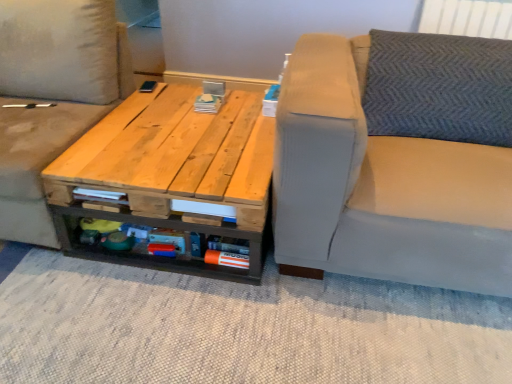
What is the approximate width of light beige fabric studio couch at right, which appears as the second studio couch when viewed from the left?

The width of light beige fabric studio couch at right, which appears as the second studio couch when viewed from the left, is 1.00 meters.

This screenshot has width=512, height=384. In order to click on light beige fabric studio couch at right, arranged as the 1th studio couch when viewed from the right in this screenshot , I will do `click(397, 159)`.

Identify the location of light beige fabric studio couch at right, which appears as the second studio couch when viewed from the left. (397, 159).

Is light beige fabric studio couch at right, arranged as the 1th studio couch when viewed from the right, in front of light beige fabric studio couch at center, which is counted as the first studio couch, starting from the left?

That is True.

Choose the correct answer: Is light beige fabric studio couch at right, arranged as the 1th studio couch when viewed from the right, inside light beige fabric studio couch at center, which appears as the 2th studio couch when viewed from the right, or outside it?

light beige fabric studio couch at right, arranged as the 1th studio couch when viewed from the right, is not inside light beige fabric studio couch at center, which appears as the 2th studio couch when viewed from the right, it's outside.

Which is more to the right, light beige fabric studio couch at right, arranged as the 1th studio couch when viewed from the right, or light beige fabric studio couch at center, which is counted as the first studio couch, starting from the left?

light beige fabric studio couch at right, arranged as the 1th studio couch when viewed from the right.

From the image's perspective, is light beige fabric studio couch at right, which appears as the second studio couch when viewed from the left, above or below light beige fabric studio couch at center, which appears as the 2th studio couch when viewed from the right?

Based on their image positions, light beige fabric studio couch at right, which appears as the second studio couch when viewed from the left, is located beneath light beige fabric studio couch at center, which appears as the 2th studio couch when viewed from the right.

Is natural wood table at center in front of light beige fabric studio couch at right, which appears as the second studio couch when viewed from the left?

That is False.

From a real-world perspective, is natural wood table at center positioned above or below light beige fabric studio couch at right, which appears as the second studio couch when viewed from the left?

natural wood table at center is below light beige fabric studio couch at right, which appears as the second studio couch when viewed from the left.

Is natural wood table at center bigger than light beige fabric studio couch at right, which appears as the second studio couch when viewed from the left?

Incorrect, natural wood table at center is not larger than light beige fabric studio couch at right, which appears as the second studio couch when viewed from the left.

Is light beige fabric studio couch at center, which appears as the 2th studio couch when viewed from the right, to the right of natural wood table at center from the viewer's perspective?

No, light beige fabric studio couch at center, which appears as the 2th studio couch when viewed from the right, is not to the right of natural wood table at center.

Does light beige fabric studio couch at center, which appears as the 2th studio couch when viewed from the right, lie behind natural wood table at center?

No, light beige fabric studio couch at center, which appears as the 2th studio couch when viewed from the right, is closer to the viewer.

Is point (84, 68) positioned before point (196, 134)?

That is False.

Looking at the image, does light beige fabric studio couch at center, which appears as the 2th studio couch when viewed from the right, seem bigger or smaller compared to natural wood table at center?

light beige fabric studio couch at center, which appears as the 2th studio couch when viewed from the right, is bigger than natural wood table at center.

How much distance is there between natural wood table at center and light beige fabric studio couch at center, which appears as the 2th studio couch when viewed from the right?

natural wood table at center and light beige fabric studio couch at center, which appears as the 2th studio couch when viewed from the right, are 13.68 inches apart.

In terms of size, does natural wood table at center appear bigger or smaller than light beige fabric studio couch at center, which is counted as the first studio couch, starting from the left?

In the image, natural wood table at center appears to be smaller than light beige fabric studio couch at center, which is counted as the first studio couch, starting from the left.

Is point (124, 215) farther from viewer compared to point (35, 26)?

That is False.

Considering the relative sizes of natural wood table at center and light beige fabric studio couch at center, which appears as the 2th studio couch when viewed from the right, in the image provided, is natural wood table at center taller than light beige fabric studio couch at center, which appears as the 2th studio couch when viewed from the right,?

No.

Can you confirm if light beige fabric studio couch at center, which is counted as the first studio couch, starting from the left, is wider than light beige fabric studio couch at right, which appears as the second studio couch when viewed from the left?

Incorrect, the width of light beige fabric studio couch at center, which is counted as the first studio couch, starting from the left, does not surpass that of light beige fabric studio couch at right, which appears as the second studio couch when viewed from the left.

Locate an element on the screen. The height and width of the screenshot is (384, 512). studio couch behind the light beige fabric studio couch at right, arranged as the 1th studio couch when viewed from the right is located at coordinates (52, 97).

Would you say light beige fabric studio couch at right, arranged as the 1th studio couch when viewed from the right, is part of light beige fabric studio couch at center, which is counted as the first studio couch, starting from the left,'s contents?

No, light beige fabric studio couch at right, arranged as the 1th studio couch when viewed from the right, is not a part of light beige fabric studio couch at center, which is counted as the first studio couch, starting from the left.

How many degrees apart are the facing directions of light beige fabric studio couch at center, which appears as the 2th studio couch when viewed from the right, and light beige fabric studio couch at right, arranged as the 1th studio couch when viewed from the right?

light beige fabric studio couch at center, which appears as the 2th studio couch when viewed from the right, and light beige fabric studio couch at right, arranged as the 1th studio couch when viewed from the right, are facing 1.76 degrees away from each other.

How many degrees apart are the facing directions of light beige fabric studio couch at right, arranged as the 1th studio couch when viewed from the right, and natural wood table at center?

They differ by 1.49 degrees in their facing directions.

In the image, there is a light beige fabric studio couch at right, arranged as the 1th studio couch when viewed from the right. What are the coordinates of `table below it (from the image's perspective)` in the screenshot? It's located at (x=170, y=175).

Are light beige fabric studio couch at right, arranged as the 1th studio couch when viewed from the right, and natural wood table at center far apart?

No, light beige fabric studio couch at right, arranged as the 1th studio couch when viewed from the right, is not far from natural wood table at center.

At what (x,y) coordinates should I click in order to perform the action: click on studio couch below the light beige fabric studio couch at center, which is counted as the first studio couch, starting from the left (from a real-world perspective). Please return your answer as a coordinate pair (x, y). Image resolution: width=512 pixels, height=384 pixels. Looking at the image, I should click on (397, 159).

Find the location of a particular element. The height and width of the screenshot is (384, 512). table located on the left of light beige fabric studio couch at right, arranged as the 1th studio couch when viewed from the right is located at coordinates (170, 175).

When comparing their distances from natural wood table at center, does light beige fabric studio couch at center, which is counted as the first studio couch, starting from the left, or light beige fabric studio couch at right, which appears as the second studio couch when viewed from the left, seem closer?

Among the two, light beige fabric studio couch at center, which is counted as the first studio couch, starting from the left, is located nearer to natural wood table at center.

Based on their spatial positions, is light beige fabric studio couch at center, which appears as the 2th studio couch when viewed from the right, or natural wood table at center further from light beige fabric studio couch at right, which appears as the second studio couch when viewed from the left?

light beige fabric studio couch at center, which appears as the 2th studio couch when viewed from the right.

Based on the photo, when comparing their distances from natural wood table at center, does light beige fabric studio couch at right, which appears as the second studio couch when viewed from the left, or light beige fabric studio couch at center, which is counted as the first studio couch, starting from the left, seem closer?

Among the two, light beige fabric studio couch at center, which is counted as the first studio couch, starting from the left, is located nearer to natural wood table at center.

When comparing their distances from light beige fabric studio couch at center, which appears as the 2th studio couch when viewed from the right, does natural wood table at center or light beige fabric studio couch at right, arranged as the 1th studio couch when viewed from the right, seem closer?

Based on the image, natural wood table at center appears to be nearer to light beige fabric studio couch at center, which appears as the 2th studio couch when viewed from the right.

Based on their spatial positions, is natural wood table at center or light beige fabric studio couch at center, which appears as the 2th studio couch when viewed from the right, closer to light beige fabric studio couch at right, arranged as the 1th studio couch when viewed from the right?

natural wood table at center.

Which object lies nearer to the anchor point light beige fabric studio couch at center, which is counted as the first studio couch, starting from the left, light beige fabric studio couch at right, which appears as the second studio couch when viewed from the left, or natural wood table at center?

natural wood table at center is positioned closer to the anchor light beige fabric studio couch at center, which is counted as the first studio couch, starting from the left.

What are the coordinates of `table located between light beige fabric studio couch at center, which appears as the 2th studio couch when viewed from the right, and light beige fabric studio couch at right, which appears as the second studio couch when viewed from the left, in the left-right direction` in the screenshot? It's located at (170, 175).